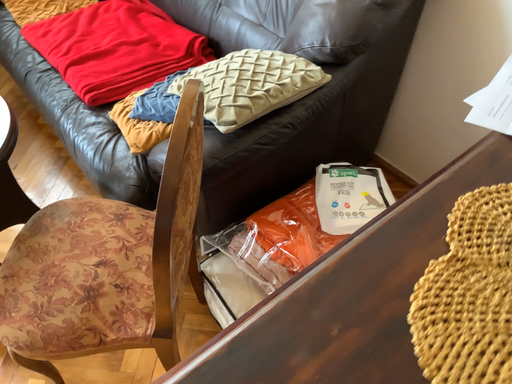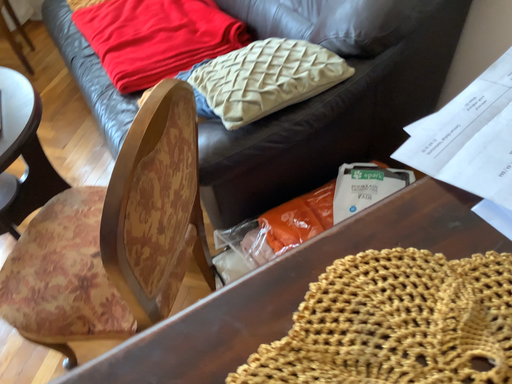
Question: How did the camera likely rotate when shooting the video?

Choices:
 (A) rotated right
 (B) rotated left

Answer: (B)